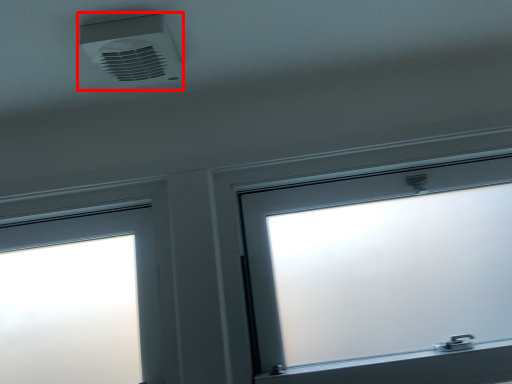
Question: From the image's perspective, what is the correct spatial relationship of air conditioning (annotated by the red box) in relation to window?

Choices:
 (A) above
 (B) below

Answer: (A)